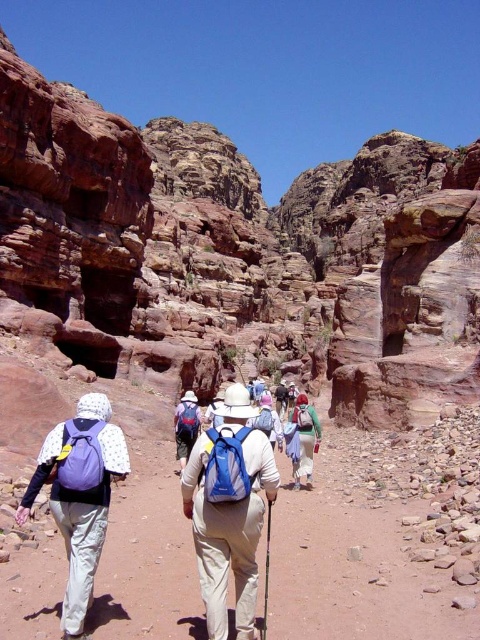
You are a hiker who wants to take a photo of the blue fabric backpack at center from your current position. Your camera has a maximum range of 30 meters. Can you capture the backpack in your photo?

The blue fabric backpack at center and camera are 29.99 meters apart, so yes, you can capture the backpack in your photo since the distance is within the camera maximum range of 30 meters.